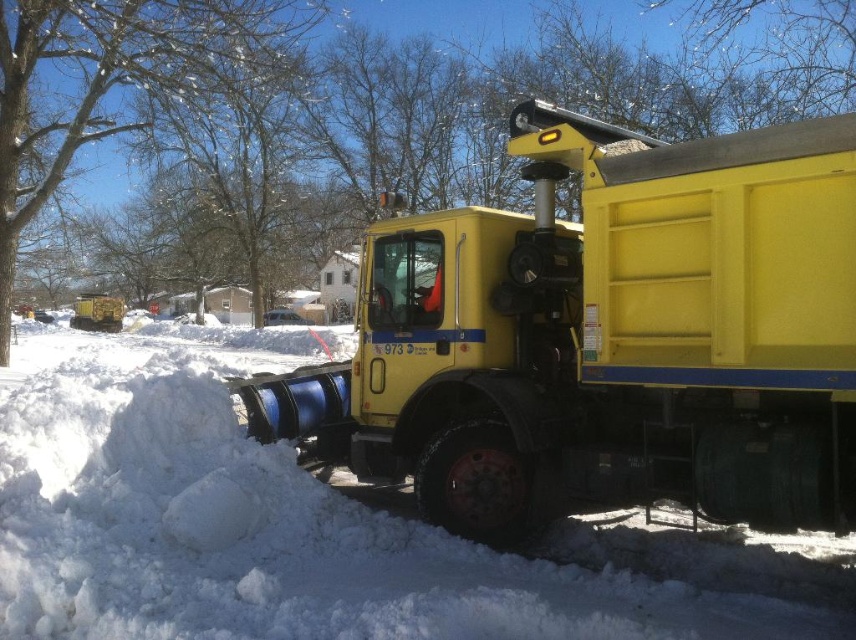
Question: Does yellow matte truck at center have a smaller size compared to white fluffy snow at lower left?

Choices:
 (A) no
 (B) yes

Answer: (B)

Question: Is yellow matte truck at center thinner than white fluffy snow at lower left?

Choices:
 (A) yes
 (B) no

Answer: (A)

Question: Can you confirm if yellow matte truck at center is wider than white fluffy snow at lower left?

Choices:
 (A) no
 (B) yes

Answer: (A)

Question: Which of the following is the farthest from the observer?

Choices:
 (A) (700, 561)
 (B) (486, 417)

Answer: (B)

Question: Which point appears farthest from the camera in this image?

Choices:
 (A) (241, 470)
 (B) (645, 481)

Answer: (A)